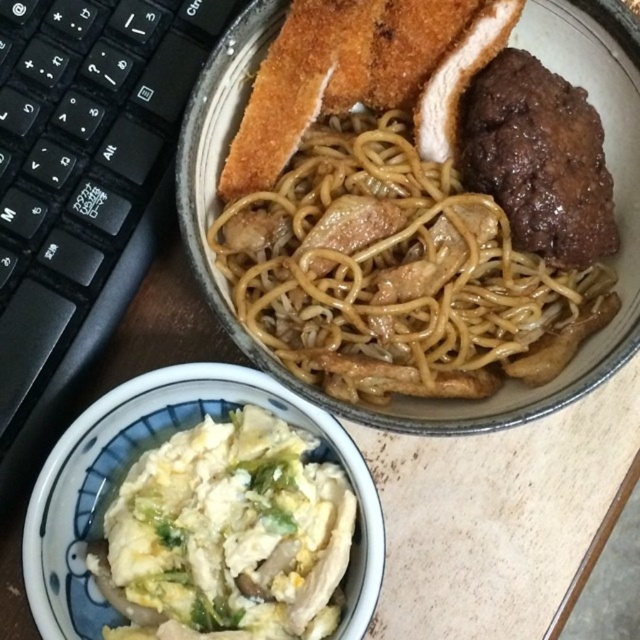
Question: Observing the image, what is the correct spatial positioning of brown glossy noodles at center in reference to black plastic keyboard at upper left?

Choices:
 (A) below
 (B) above

Answer: (A)

Question: Does black plastic keyboard at upper left have a larger size compared to brown glossy meat at center?

Choices:
 (A) yes
 (B) no

Answer: (A)

Question: Is brown glossy noodles at center below white fluffy scrambled eggs at lower left?

Choices:
 (A) yes
 (B) no

Answer: (B)

Question: Which point is farther to the camera?

Choices:
 (A) black plastic keyboard at upper left
 (B) brown glossy meat at center

Answer: (A)

Question: Among these objects, which one is farthest from the camera?

Choices:
 (A) white fluffy scrambled eggs at lower left
 (B) black plastic keyboard at upper left

Answer: (B)

Question: Which point is closer to the camera?

Choices:
 (A) pos(189,515)
 (B) pos(60,216)

Answer: (A)